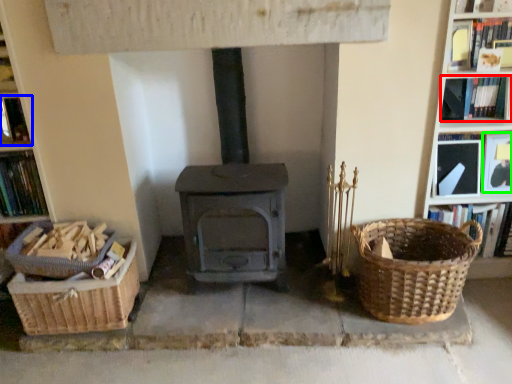
Question: Estimate the real-world distances between objects in this image. Which object is closer to book (highlighted by a red box), book (highlighted by a blue box) or book (highlighted by a green box)?

Choices:
 (A) book
 (B) book

Answer: (B)